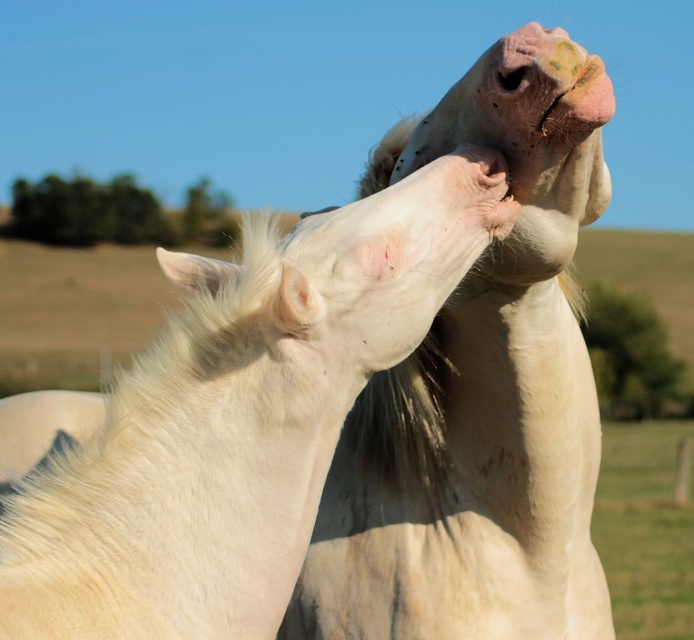
You are a photographer trying to capture the white matte horse at center and the white soft fur at center in a single shot. Which object should you focus on first to ensure both are in focus?

You should focus on the white matte horse at center first because it is closer to the viewer than the white soft fur at center, allowing the soft fur to fall within the depth of field.

You are a photographer trying to capture both the white matte horse at center and the white soft fur at center in a single frame. Based on their widths, which horse should you position closer to the camera to ensure both fit in the photo?

The white matte horse at center might be wider than white soft fur at center, so positioning the wider white matte horse at center closer to the camera would help ensure both fit in the frame.

You are a photographer standing at the point with coordinates (230, 429) in the image. Looking at the scene, which object are you standing on?

The point with coordinates (230, 429) is located on the white matte horse at upper center, so you are standing on the white matte horse at upper center.